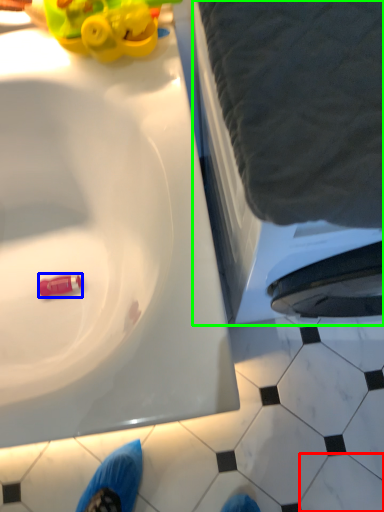
Question: Which object is positioned closest to tile (highlighted by a red box)? Select from toy (highlighted by a blue box) and bath (highlighted by a green box).

Choices:
 (A) toy
 (B) bath

Answer: (B)